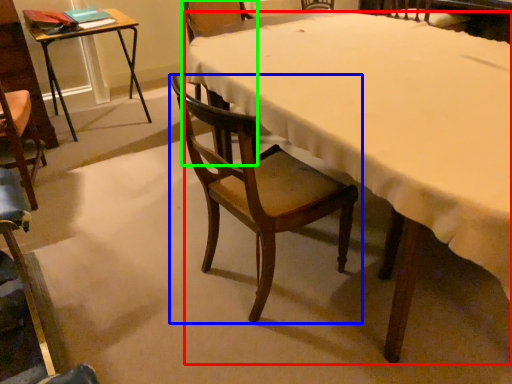
Question: Based on their relative distances, which object is nearer to desk (highlighted by a red box)? Choose from chair (highlighted by a blue box) and chair (highlighted by a green box).

Choices:
 (A) chair
 (B) chair

Answer: (A)